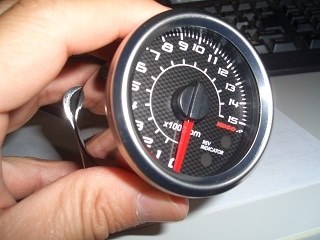
This screenshot has height=240, width=320. Identify the location of keyboard. (294, 45).